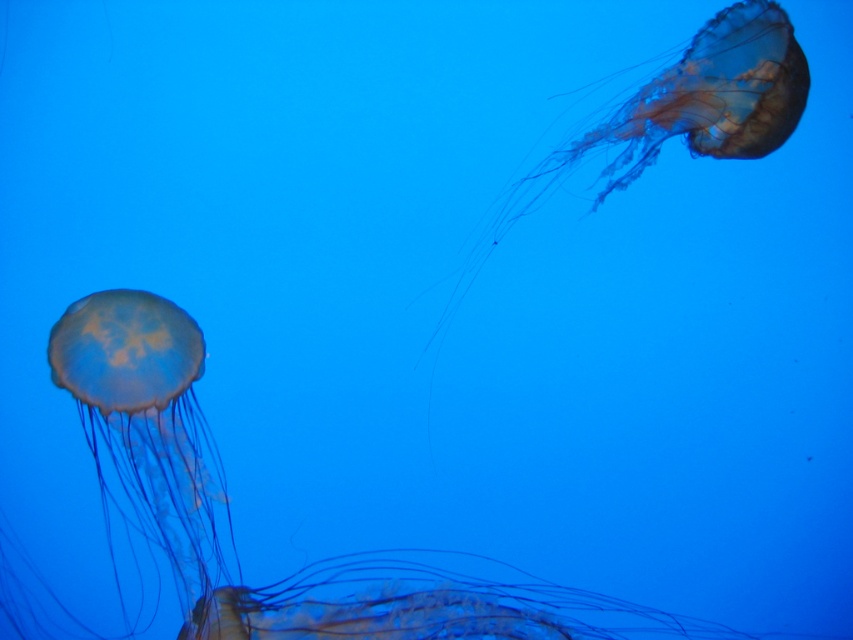
Question: Is translucent yellow jellyfish at lower left to the right of translucent gelatinous at upper right from the viewer's perspective?

Choices:
 (A) yes
 (B) no

Answer: (B)

Question: Which point is farther from the camera taking this photo?

Choices:
 (A) (305, 602)
 (B) (709, 150)

Answer: (B)

Question: Can you confirm if translucent yellow jellyfish at lower left is positioned to the right of translucent gelatinous at upper right?

Choices:
 (A) yes
 (B) no

Answer: (B)

Question: Which point appears farthest from the camera in this image?

Choices:
 (A) (653, 115)
 (B) (154, 472)

Answer: (A)

Question: Can you confirm if translucent yellow jellyfish at lower left is positioned to the left of translucent gelatinous at upper right?

Choices:
 (A) no
 (B) yes

Answer: (B)